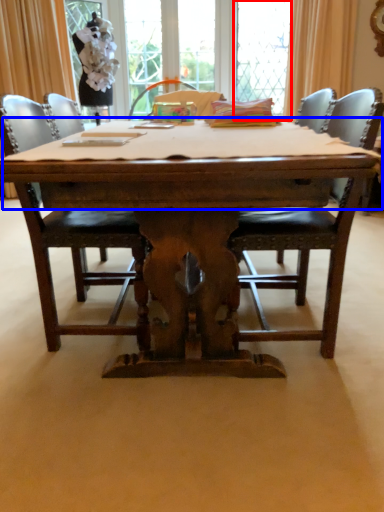
Question: Which of the following is the closest to the observer, window screen (highlighted by a red box) or table top (highlighted by a blue box)?

Choices:
 (A) window screen
 (B) table top

Answer: (B)